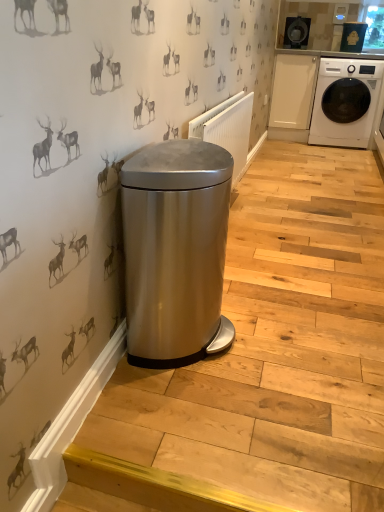
This screenshot has width=384, height=512. What are the coordinates of `unoccupied region to the right of satin silver trash can at center` in the screenshot? It's located at (285, 345).